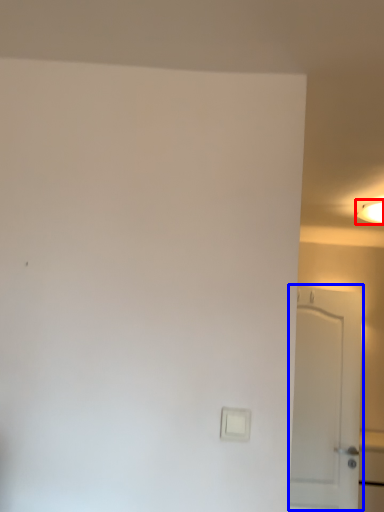
Question: Which point is further to the camera, lighting (highlighted by a red box) or door (highlighted by a blue box)?

Choices:
 (A) lighting
 (B) door

Answer: (A)